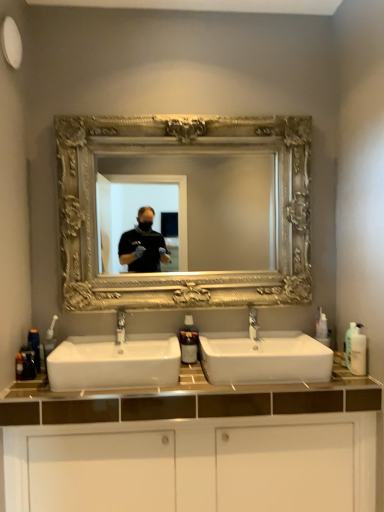
Identify the location of vacant space situated on the left part of silver metallic tap at center, which is the 2th tap from left to right. The width and height of the screenshot is (384, 512). (226, 348).